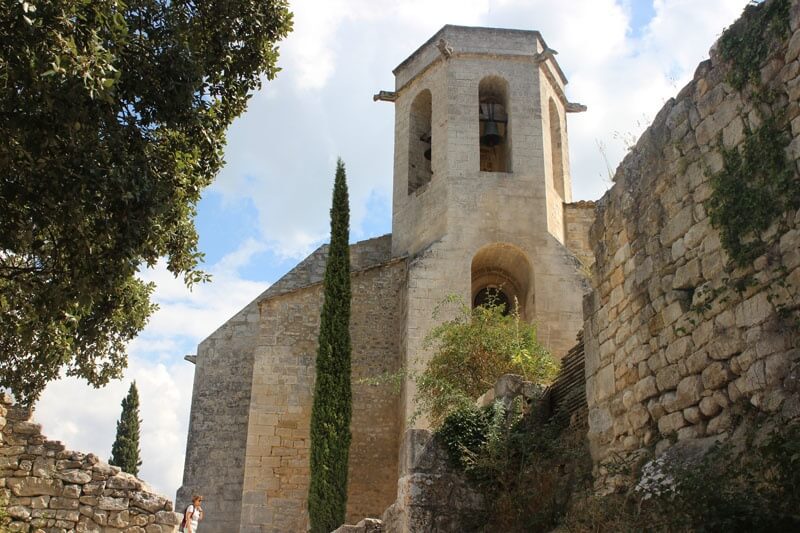
Locate an element on the screen. This screenshot has height=533, width=800. arch is located at coordinates (505, 265).